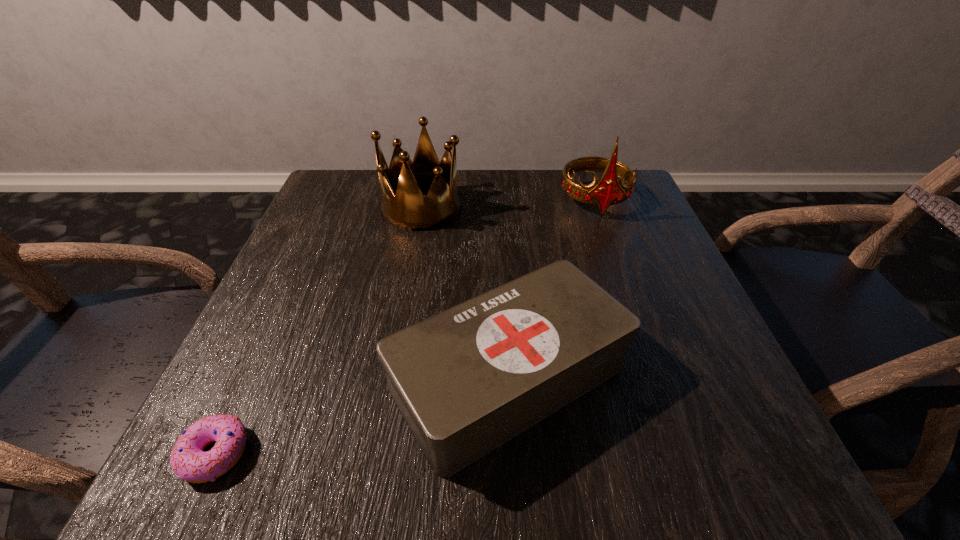
Image resolution: width=960 pixels, height=540 pixels. What are the coordinates of `free space at the near edge of the desktop` in the screenshot? It's located at pyautogui.click(x=328, y=492).

This screenshot has width=960, height=540. Identify the location of free region at the left edge of the desktop. (292, 333).

This screenshot has height=540, width=960. Identify the location of free space at the right edge. (678, 350).

Locate an element on the screen. The image size is (960, 540). vacant space at the far left corner of the desktop is located at coordinates (343, 193).

Locate an element on the screen. free point at the near right corner is located at coordinates (677, 460).

In order to click on vacant space that is in between the crown and the tiara in this screenshot , I will do `click(508, 204)`.

Where is `free space between the crown and the tiara`? This screenshot has height=540, width=960. free space between the crown and the tiara is located at coordinates (508, 204).

This screenshot has width=960, height=540. What are the coordinates of `free space between the tiara and the doughnut` in the screenshot? It's located at (405, 327).

This screenshot has width=960, height=540. Identify the location of blank region between the crown and the shortest object. (319, 330).

Find the location of a particular element. This screenshot has height=540, width=960. vacant space that's between the doughnut and the tiara is located at coordinates (405, 327).